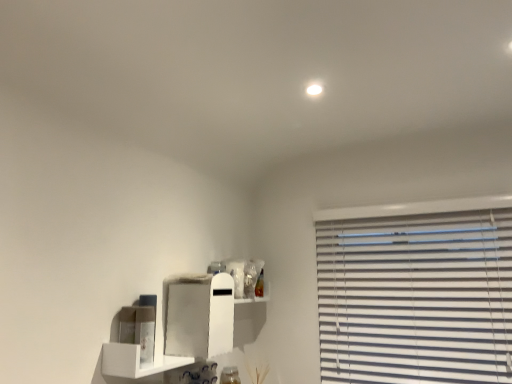
Question: Relative to white matte cabinet at center, is white matte shelf at lower left in front or behind?

Choices:
 (A) behind
 (B) front

Answer: (B)

Question: Would you say white matte shelf at lower left is inside or outside white matte cabinet at center?

Choices:
 (A) outside
 (B) inside

Answer: (B)

Question: From the image's perspective, is white matte shelf at lower left above or below white matte cabinet at center?

Choices:
 (A) below
 (B) above

Answer: (A)

Question: Is white matte cabinet at center bigger or smaller than white matte shelf at lower left?

Choices:
 (A) small
 (B) big

Answer: (B)

Question: Which is correct: white matte cabinet at center is inside white matte shelf at lower left, or outside of it?

Choices:
 (A) inside
 (B) outside

Answer: (B)

Question: Considering the positions of white matte cabinet at center and white matte shelf at lower left in the image, is white matte cabinet at center taller or shorter than white matte shelf at lower left?

Choices:
 (A) tall
 (B) short

Answer: (A)

Question: Is point (206, 299) closer or farther from the camera than point (135, 360)?

Choices:
 (A) farther
 (B) closer

Answer: (A)